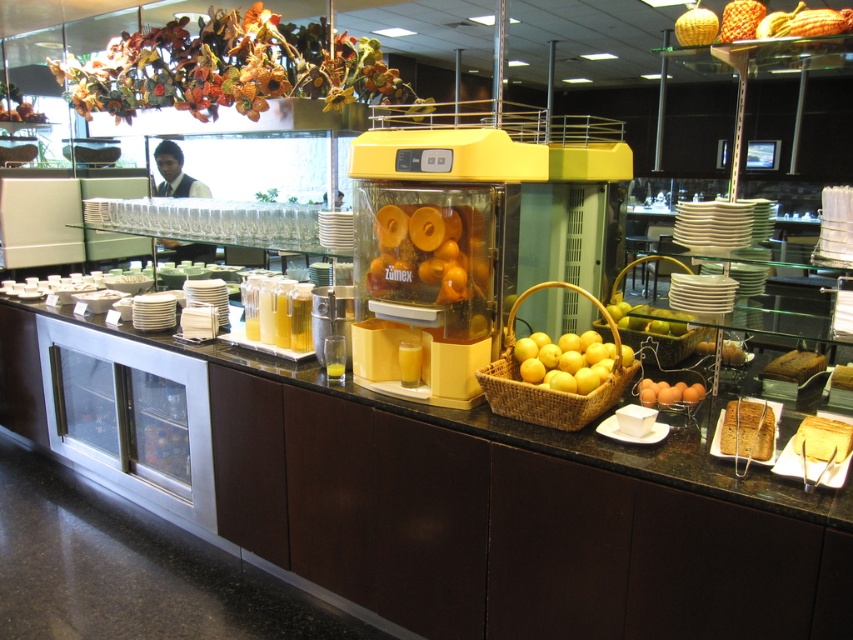
Question: Which is farther from the golden brown bread at right?

Choices:
 (A) woven brown basket at center
 (B) brown crumbly bread at right
 (C) yellow sponge cake at center

Answer: (A)

Question: Can you confirm if orange matte juicer at center is thinner than brown matte eggs at center?

Choices:
 (A) yes
 (B) no

Answer: (B)

Question: Which is farther from the brown crumbly bread at right?

Choices:
 (A) woven brown basket at center
 (B) brown matte eggs at center
 (C) yellow matte lemons at center
 (D) golden brown bread at right

Answer: (A)

Question: Does woven brown basket at center have a smaller size compared to yellow matte lemons at center?

Choices:
 (A) no
 (B) yes

Answer: (A)

Question: Which point is farther from the camera taking this photo?

Choices:
 (A) (569, 422)
 (B) (787, 355)

Answer: (B)

Question: Does woven brown basket at center appear on the right side of brown woven basket at center?

Choices:
 (A) yes
 (B) no

Answer: (B)